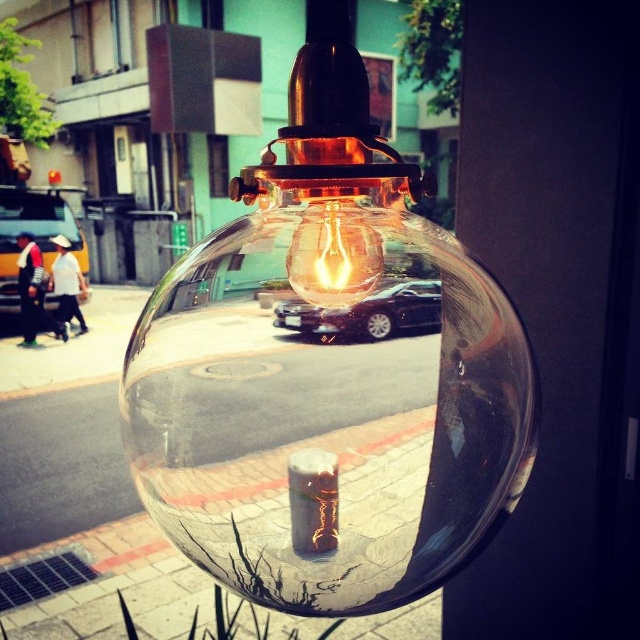
Can you confirm if transparent glass globe at center is positioned to the left of translucent glass bulb at center?

Indeed, transparent glass globe at center is positioned on the left side of translucent glass bulb at center.

Which is in front, point (534, 396) or point (337, 224)?

Point (337, 224)

The height and width of the screenshot is (640, 640). I want to click on transparent glass globe at center, so click(x=328, y=403).